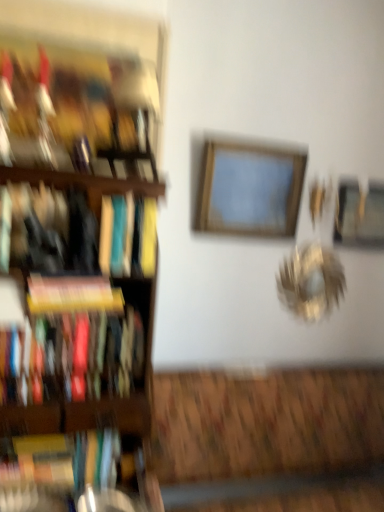
Question: Is hardcover book at left, acting as the first book starting from the bottom, at the back of hardcover book at left, which ranks as the fifth book in bottom-to-top order?

Choices:
 (A) no
 (B) yes

Answer: (A)

Question: Does hardcover book at left, which ranks as the fifth book in bottom-to-top order, have a larger size compared to hardcover book at left, positioned as the fifth book in top-to-bottom order?

Choices:
 (A) no
 (B) yes

Answer: (B)

Question: Is hardcover book at left, the first book positioned from the top, to the right of hardcover book at left, positioned as the fifth book in top-to-bottom order, from the viewer's perspective?

Choices:
 (A) no
 (B) yes

Answer: (B)

Question: Considering the relative sizes of hardcover book at left, the first book positioned from the top, and hardcover book at left, positioned as the fifth book in top-to-bottom order, in the image provided, is hardcover book at left, the first book positioned from the top, wider than hardcover book at left, positioned as the fifth book in top-to-bottom order,?

Choices:
 (A) yes
 (B) no

Answer: (B)

Question: Is hardcover book at left, which ranks as the fifth book in bottom-to-top order, outside of hardcover book at left, acting as the first book starting from the bottom?

Choices:
 (A) yes
 (B) no

Answer: (A)

Question: Is hardcover book at left, positioned as the fifth book in top-to-bottom order, surrounded by hardcover book at left, which ranks as the fifth book in bottom-to-top order?

Choices:
 (A) no
 (B) yes

Answer: (A)

Question: Can you confirm if yellow matte book at left, the third book when ordered from top to bottom, is smaller than matte hardcover book at left, which is the 4th book from top to bottom?

Choices:
 (A) no
 (B) yes

Answer: (B)

Question: Considering the relative sizes of yellow matte book at left, the third book when ordered from top to bottom, and matte hardcover book at left, the second book in the bottom-to-top sequence, in the image provided, is yellow matte book at left, the third book when ordered from top to bottom, bigger than matte hardcover book at left, the second book in the bottom-to-top sequence,?

Choices:
 (A) yes
 (B) no

Answer: (B)

Question: From the image's perspective, does yellow matte book at left, the third book when ordered from top to bottom, appear higher than matte hardcover book at left, which is the 4th book from top to bottom?

Choices:
 (A) no
 (B) yes

Answer: (B)

Question: Is yellow matte book at left, acting as the third book starting from the bottom, far from matte hardcover book at left, which is the 4th book from top to bottom?

Choices:
 (A) yes
 (B) no

Answer: (B)

Question: Can you confirm if yellow matte book at left, acting as the third book starting from the bottom, is shorter than matte hardcover book at left, which is the 4th book from top to bottom?

Choices:
 (A) yes
 (B) no

Answer: (A)

Question: From the image's perspective, is yellow matte book at left, acting as the third book starting from the bottom, located beneath matte hardcover book at left, the second book in the bottom-to-top sequence?

Choices:
 (A) yes
 (B) no

Answer: (B)

Question: Are hardcover book at left, acting as the first book starting from the bottom, and wooden frame at center, the 1th picture frame in the front-to-back sequence, making contact?

Choices:
 (A) no
 (B) yes

Answer: (A)